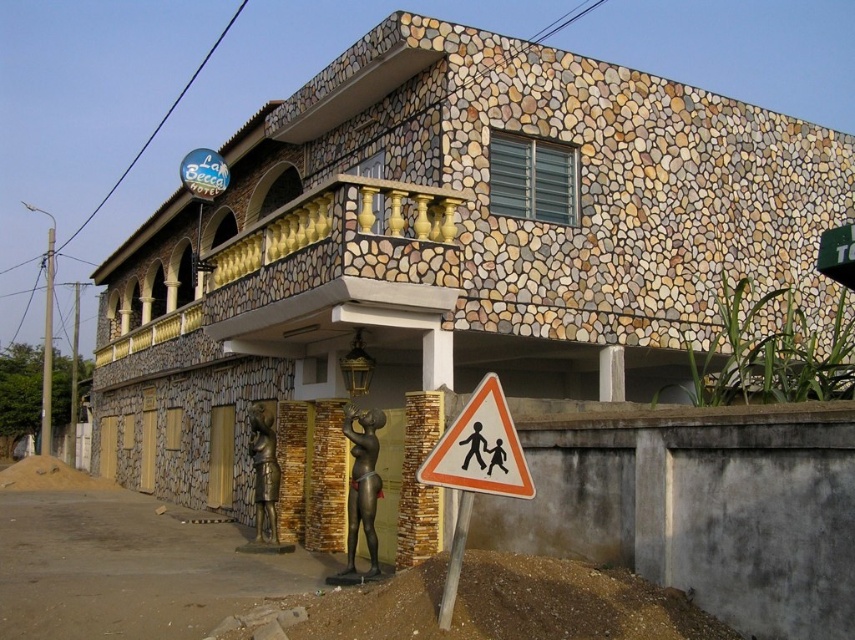
Which is more to the right, bronze statue at center or metallic pole at lower center?

From the viewer's perspective, metallic pole at lower center appears more on the right side.

Which is more to the left, bronze statue at center or metallic pole at lower center?

From the viewer's perspective, bronze statue at center appears more on the left side.

Measure the distance between bronze statue at center and camera.

They are 15.85 meters apart.

The width and height of the screenshot is (855, 640). Find the location of `bronze statue at center`. bronze statue at center is located at coordinates (263, 470).

Between metallic pole at left and metallic pole at lower center, which one has more height?

With more height is metallic pole at left.

This screenshot has height=640, width=855. Identify the location of metallic pole at left. (46, 346).

Between point (475, 417) and point (441, 595), which one is positioned in front?

Positioned in front is point (441, 595).

Where is `white plastic triangle at lower center`? Image resolution: width=855 pixels, height=640 pixels. white plastic triangle at lower center is located at coordinates [481, 449].

This screenshot has height=640, width=855. In order to click on white plastic triangle at lower center in this screenshot , I will do `click(481, 449)`.